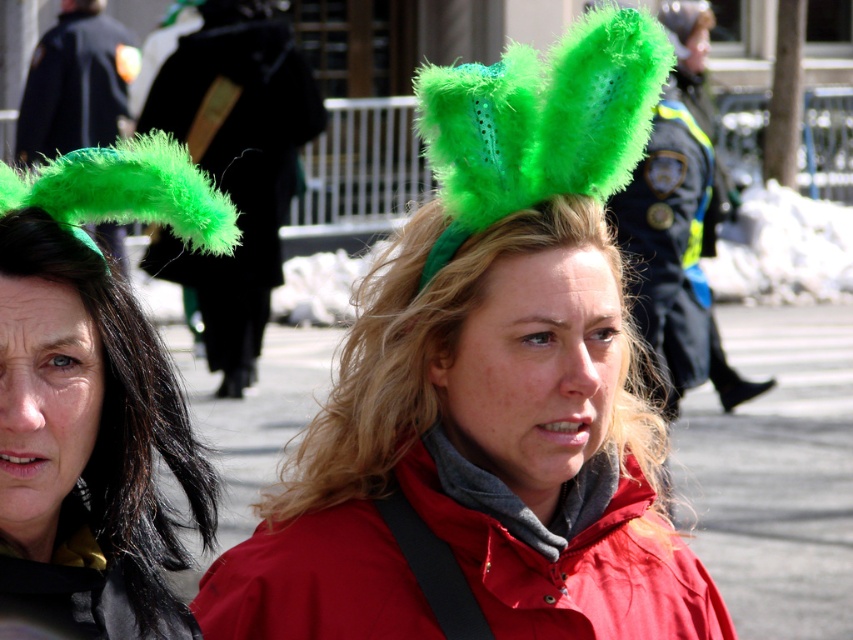
You are a photographer at the event and want to capture both the green fuzzy hat at upper left and the black fabric jacket at upper left in a single frame. Considering their heights, which object should you focus on first to ensure both are in the shot?

The green fuzzy hat at upper left is shorter than the black fabric jacket at upper left. To capture both in a single frame, focus on the black fabric jacket at upper left first as it is taller, ensuring the shorter green fuzzy hat at upper left will also be included in the shot.

You are a photographer trying to capture a photo of the fuzzy green headband at center and the dark blue uniform at center. Which object should you focus on first to ensure both are in sharp focus?

You should focus on the fuzzy green headband at center first because it is closer to the viewer than the dark blue uniform at center, so adjusting focus from near to far will help both be in sharp focus.

You are a photographer trying to capture the perfect shot of the fuzzy green headband at center. If you move your camera 0.1 units to the left along the x axis, will the headband still be in the frame?

The fuzzy green headband at center is at point (477, 456). Moving the camera 0.1 units left along the x axis would shift the frame, but since the headband is at 0.713 on the x axis, subtracting 0.1 would bring it to 0.613, which is still within the frame. Therefore, yes, it will still be in the frame.